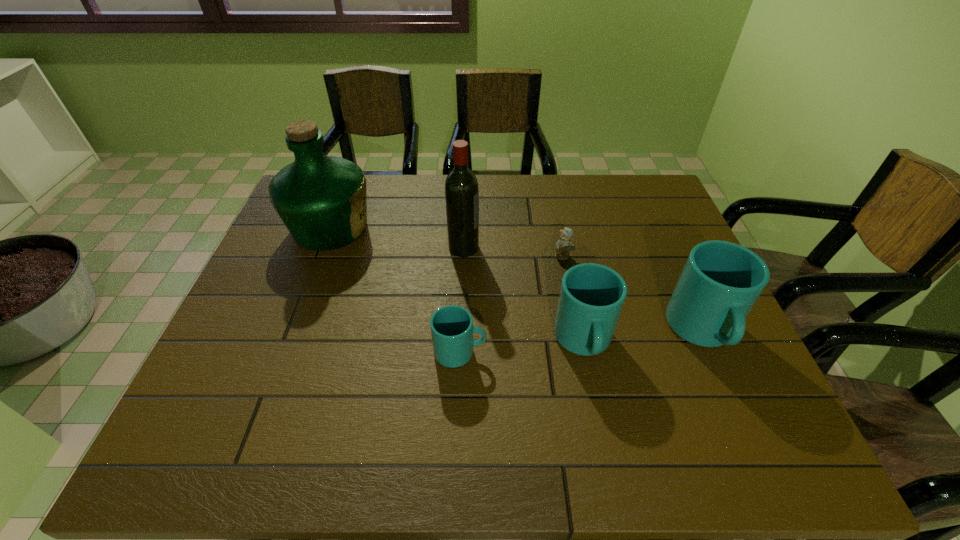
The width and height of the screenshot is (960, 540). I want to click on the fifth tallest object, so click(452, 328).

In order to click on the shortest cup in this screenshot , I will do tap(452, 328).

Where is `the second tallest cup`? Image resolution: width=960 pixels, height=540 pixels. the second tallest cup is located at coordinates (591, 298).

Locate an element on the screen. the third shortest object is located at coordinates (591, 298).

In order to click on the rightmost object in this screenshot , I will do `click(721, 281)`.

Find the location of a particular element. wine bottle is located at coordinates (461, 186).

You are a GUI agent. You are given a task and a screenshot of the screen. Output one action in this format:
    pyautogui.click(x=<x>, y=<y>)
    Task: Click on the leftmost object
    Image resolution: width=960 pixels, height=540 pixels.
    Given the screenshot: What is the action you would take?
    pyautogui.click(x=322, y=200)

The width and height of the screenshot is (960, 540). Identify the location of the shortest object. (563, 245).

Locate an element on the screen. This screenshot has height=540, width=960. blank space located on the handle side of the leftmost cup is located at coordinates (552, 352).

Locate an element on the screen. The height and width of the screenshot is (540, 960). free region located on the handle side of the fourth tallest object is located at coordinates (595, 400).